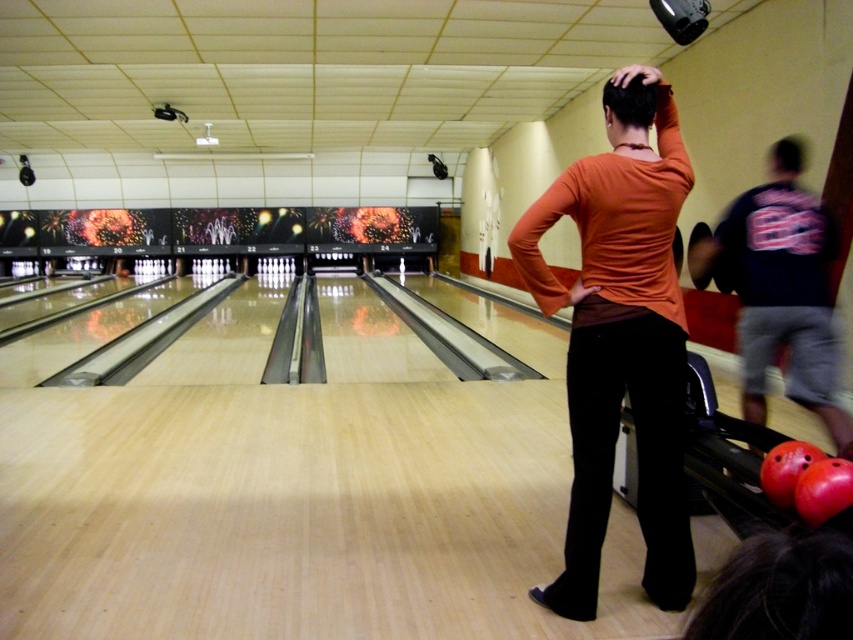
You are a photographer standing at the back of the bowling alley. You want to take a photo of the short brown hair at center and the blurred hair at upper right. Which hair will appear larger in the photo?

The short brown hair at center will appear larger in the photo because it is closer to the viewer than the blurred hair at upper right.

Looking at this image, you are standing at the entrance of the bowling alley and want to walk to the point marked as point (624, 80) and point (799, 156). Which point should you walk towards first if you want to reach the one closer to you first?

You should walk towards point (624, 80) first because it is closer to you than point (799, 156).